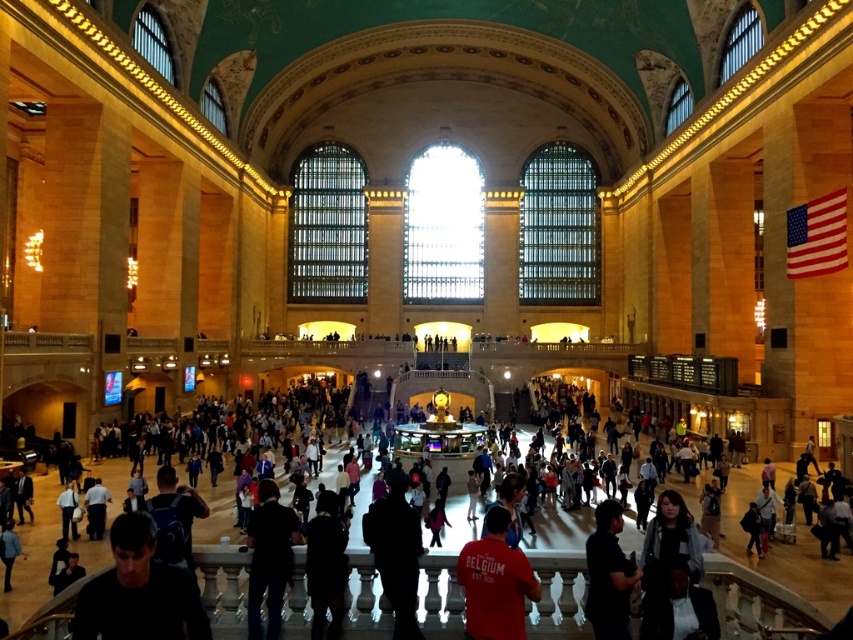
You are a tour guide leading a group through Grand Central Terminal. You notice two tourists wearing a dark gray shirt at lower left and a dark blue shirt at lower right. The terminal has a strict rule that visitors must stay within 100 feet of their tour group. Are these two tourists violating the rule?

The dark gray shirt at lower left and dark blue shirt at lower right are 111.46 feet apart from each other, which exceeds the 100 feet rule. Therefore, the two tourists are violating the rule.

Consider the image. You are standing at the entrance of Grand Central Terminal and see a person wearing a dark gray shirt at lower left. If you want to find their exact location, what coordinates would you use?

The dark gray shirt at lower left is located at coordinates point (138, 592).